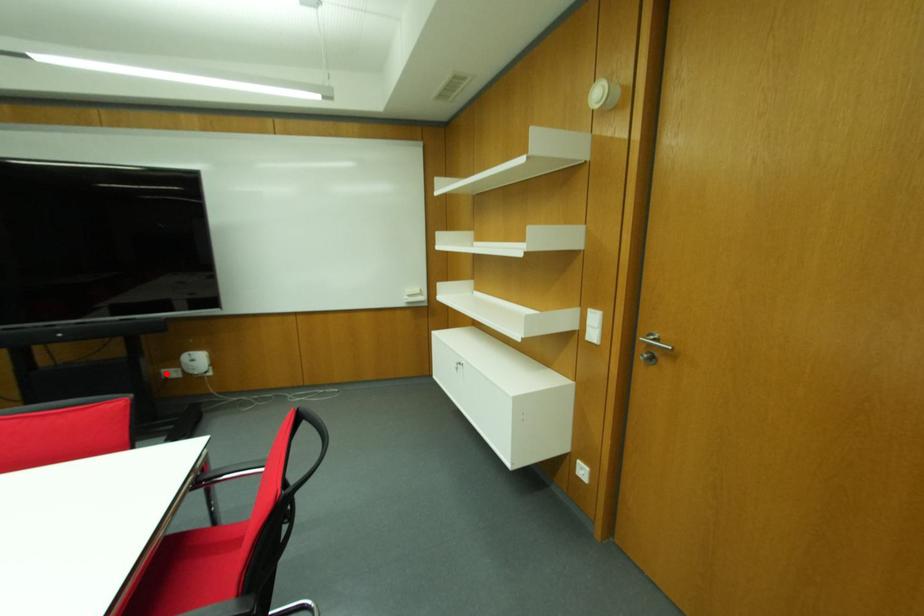
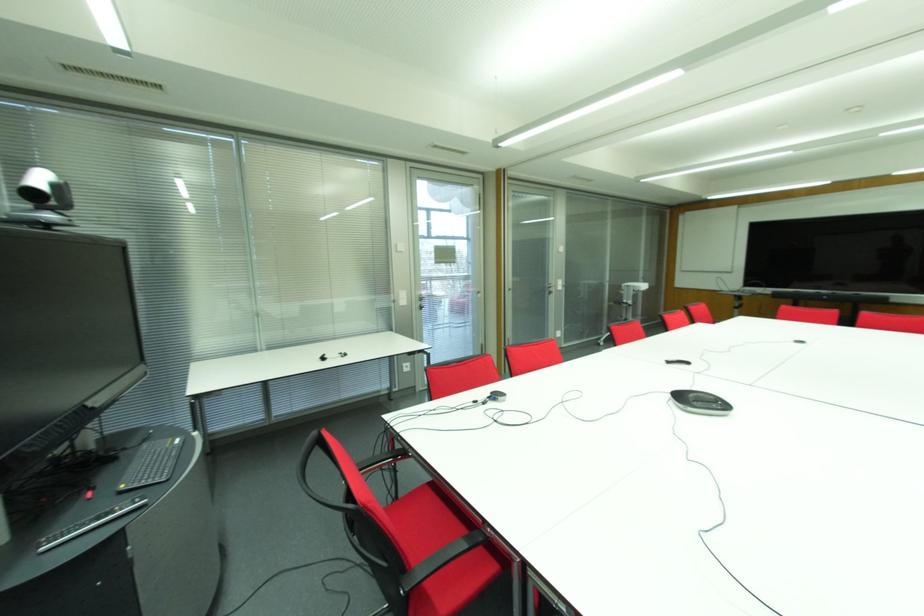
Question: I am providing you with two images of the same scene from different viewpoints. A red point is marked on the first image. Is the red point's position out of view in image 2?

Choices:
 (A) Yes
 (B) No

Answer: (A)